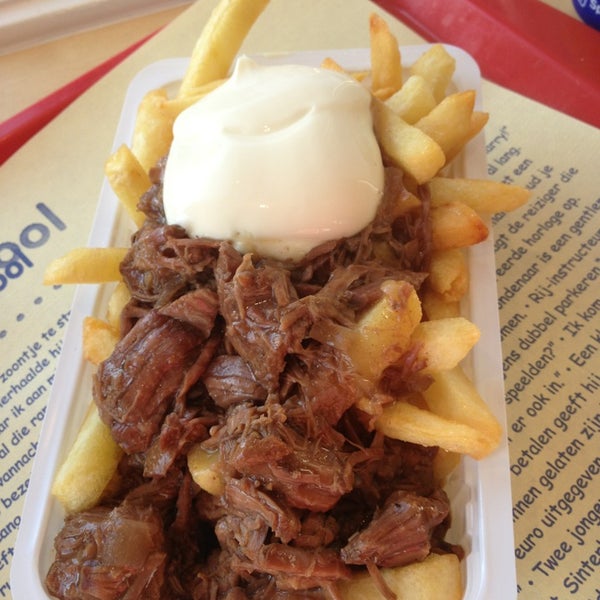
Find the location of a particular element. yellow surface under the tray is located at coordinates (37, 63).